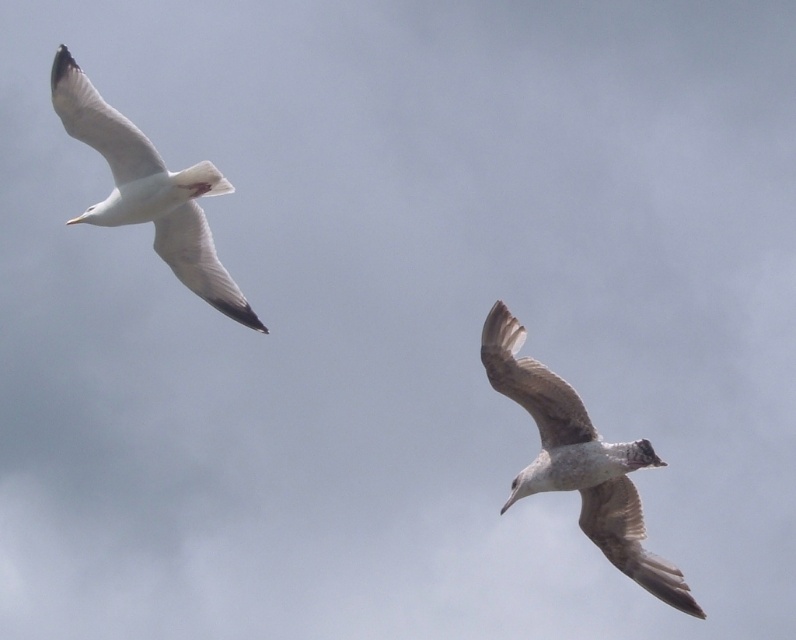
Question: Which object appears farthest from the camera in this image?

Choices:
 (A) light brown feathered bird at lower right
 (B) white feathered bird at upper left

Answer: (B)

Question: Does light brown feathered bird at lower right appear over white feathered bird at upper left?

Choices:
 (A) no
 (B) yes

Answer: (A)

Question: Is light brown feathered bird at lower right wider than white feathered bird at upper left?

Choices:
 (A) yes
 (B) no

Answer: (A)

Question: Is light brown feathered bird at lower right positioned in front of white feathered bird at upper left?

Choices:
 (A) yes
 (B) no

Answer: (A)

Question: Which of the following is the closest to the observer?

Choices:
 (A) white feathered bird at upper left
 (B) light brown feathered bird at lower right

Answer: (B)

Question: Which object appears closest to the camera in this image?

Choices:
 (A) light brown feathered bird at lower right
 (B) white feathered bird at upper left

Answer: (A)